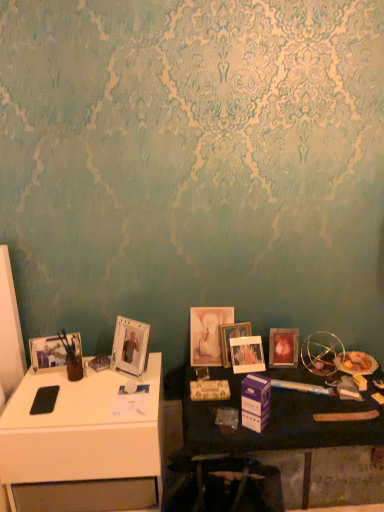
Question: Does matte silver picture frame at left, acting as the first picture frame starting from the left, have a smaller size compared to clear plastic picture frame at left, the 5th picture frame viewed from the right?

Choices:
 (A) yes
 (B) no

Answer: (A)

Question: Can you confirm if matte silver picture frame at left, acting as the first picture frame starting from the left, is shorter than clear plastic picture frame at left, the 5th picture frame viewed from the right?

Choices:
 (A) no
 (B) yes

Answer: (B)

Question: From a real-world perspective, is matte silver picture frame at left, acting as the first picture frame starting from the left, located higher than clear plastic picture frame at left, which appears as the second picture frame when viewed from the left?

Choices:
 (A) yes
 (B) no

Answer: (B)

Question: Can you confirm if matte silver picture frame at left, marked as the 6th picture frame in a right-to-left arrangement, is wider than clear plastic picture frame at left, the 5th picture frame viewed from the right?

Choices:
 (A) no
 (B) yes

Answer: (A)

Question: Does matte silver picture frame at left, acting as the first picture frame starting from the left, lie behind clear plastic picture frame at left, the 5th picture frame viewed from the right?

Choices:
 (A) yes
 (B) no

Answer: (A)

Question: Is point (216, 314) positioned closer to the camera than point (33, 401)?

Choices:
 (A) farther
 (B) closer

Answer: (A)

Question: Relative to white glossy desk at left, is matte glass picture frame at center, acting as the fourth picture frame starting from the right, in front or behind?

Choices:
 (A) behind
 (B) front

Answer: (A)

Question: Is matte glass picture frame at center, the third picture frame when ordered from left to right, taller or shorter than white glossy desk at left?

Choices:
 (A) tall
 (B) short

Answer: (B)

Question: Based on their sizes in the image, would you say matte glass picture frame at center, acting as the fourth picture frame starting from the right, is bigger or smaller than white glossy desk at left?

Choices:
 (A) big
 (B) small

Answer: (B)

Question: Is matte glass picture frame at center right, which is the 1th picture frame in right-to-left order, in front of or behind matte silver picture frame at left, acting as the first picture frame starting from the left, in the image?

Choices:
 (A) behind
 (B) front

Answer: (A)

Question: Considering the positions of matte glass picture frame at center right, which is the 1th picture frame in right-to-left order, and matte silver picture frame at left, marked as the 6th picture frame in a right-to-left arrangement, in the image, is matte glass picture frame at center right, which is the 1th picture frame in right-to-left order, taller or shorter than matte silver picture frame at left, marked as the 6th picture frame in a right-to-left arrangement,?

Choices:
 (A) short
 (B) tall

Answer: (B)

Question: From the image's perspective, relative to matte silver picture frame at left, marked as the 6th picture frame in a right-to-left arrangement, is matte glass picture frame at center right, which is the 1th picture frame in right-to-left order, above or below?

Choices:
 (A) below
 (B) above

Answer: (A)

Question: Considering the positions of matte glass picture frame at center right, the 6th picture frame in the left-to-right sequence, and matte silver picture frame at left, acting as the first picture frame starting from the left, in the image, is matte glass picture frame at center right, the 6th picture frame in the left-to-right sequence, bigger or smaller than matte silver picture frame at left, acting as the first picture frame starting from the left,?

Choices:
 (A) big
 (B) small

Answer: (A)

Question: Do you think matte white picture frame at center, the 5th picture frame positioned from the left, is within clear plastic picture frame at left, the 5th picture frame viewed from the right, or outside of it?

Choices:
 (A) inside
 (B) outside

Answer: (B)

Question: Does point (233, 366) appear closer or farther from the camera than point (132, 333)?

Choices:
 (A) closer
 (B) farther

Answer: (B)